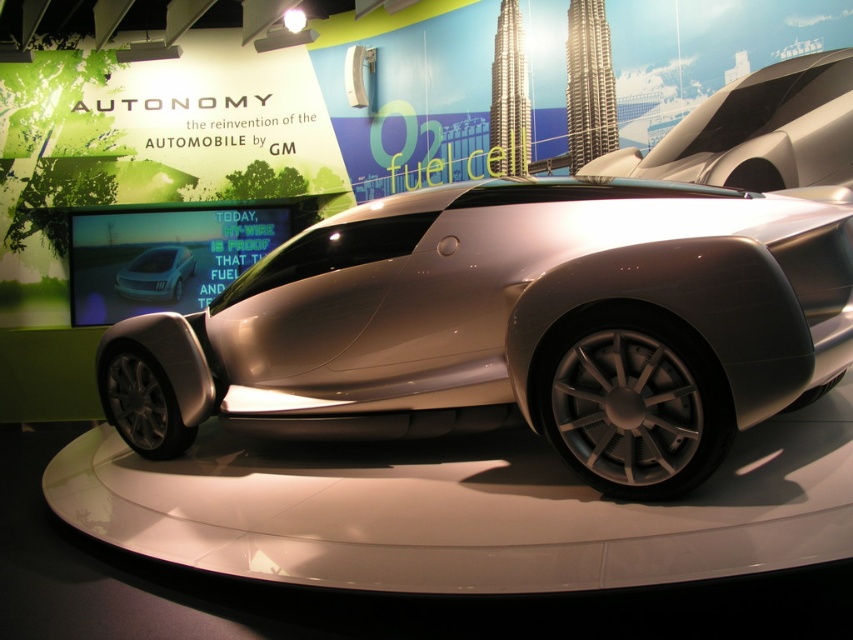
Who is higher up, silver metallic car at center or satin silver car at center?

satin silver car at center

Is silver metallic car at center taller than satin silver car at center?

Yes, silver metallic car at center is taller than satin silver car at center.

Measure the distance between point [811,296] and camera.

Point [811,296] and camera are 7.03 feet apart.

This screenshot has height=640, width=853. Find the location of `silver metallic car at center`. silver metallic car at center is located at coordinates (514, 324).